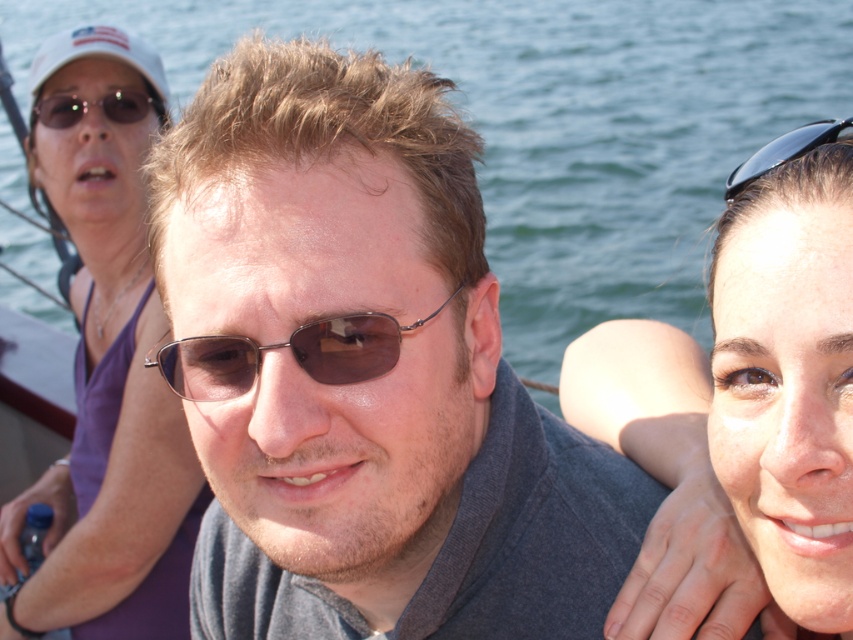
Does matte gray shirt at center appear under smooth skin face at upper right?

Actually, matte gray shirt at center is above smooth skin face at upper right.

Where is `matte gray shirt at center`? The width and height of the screenshot is (853, 640). matte gray shirt at center is located at coordinates (364, 371).

Who is higher up, purple fabric top at upper left or matte black sunglasses at upper left?

Positioned higher is matte black sunglasses at upper left.

Does purple fabric top at upper left have a lesser height compared to matte black sunglasses at upper left?

Incorrect, purple fabric top at upper left's height does not fall short of matte black sunglasses at upper left's.

Which is in front, point (79, 360) or point (117, 122)?

Point (117, 122) is in front.

Where is `purple fabric top at upper left`? This screenshot has width=853, height=640. purple fabric top at upper left is located at coordinates (107, 371).

Which of these two, smooth skin face at upper right or purple fabric top at upper left, stands shorter?

smooth skin face at upper right

Identify the location of smooth skin face at upper right. (743, 410).